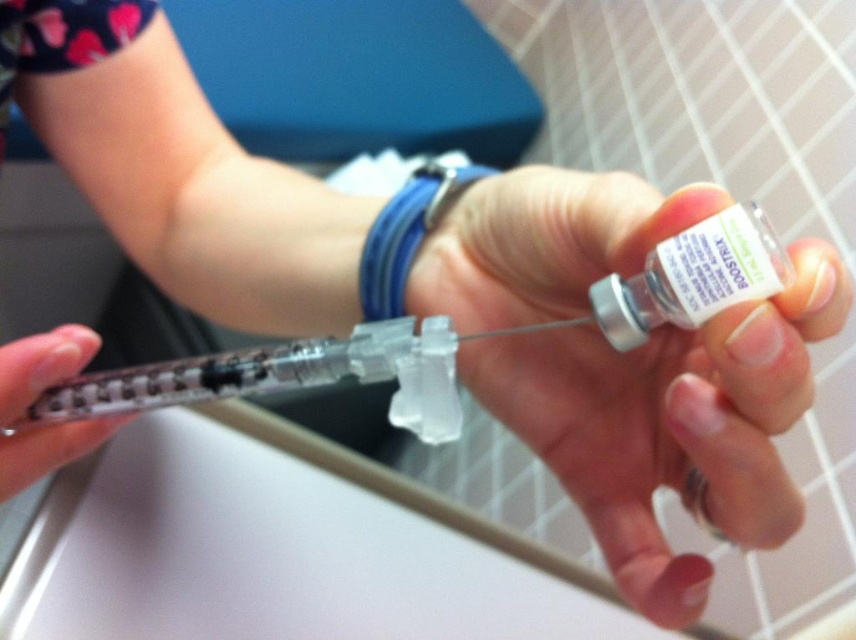
Does clear plastic syringe at lower left appear on the right side of blue rubber band at center?

In fact, clear plastic syringe at lower left is to the left of blue rubber band at center.

In the scene shown: Who is taller, clear plastic syringe at lower left or blue rubber band at center?

blue rubber band at center

The image size is (856, 640). In order to click on clear plastic syringe at lower left in this screenshot , I will do `click(40, 365)`.

The image size is (856, 640). What do you see at coordinates (670, 424) in the screenshot? I see `clear plastic vial at center` at bounding box center [670, 424].

Between clear plastic vial at center and blue rubber band at center, which one is positioned lower?

clear plastic vial at center is below.

Is point (581, 272) in front of point (414, 240)?

Yes, it is.

The height and width of the screenshot is (640, 856). Find the location of `clear plastic vial at center`. clear plastic vial at center is located at coordinates (670, 424).

Does transparent plastic syringe at center have a larger size compared to clear plastic syringe at lower left?

Yes.

Between transparent plastic syringe at center and clear plastic syringe at lower left, which one has more height?

transparent plastic syringe at center

Does point (437, 385) come farther from viewer compared to point (3, 449)?

No, it is not.

Where is `transparent plastic syringe at center`? This screenshot has width=856, height=640. transparent plastic syringe at center is located at coordinates (446, 337).